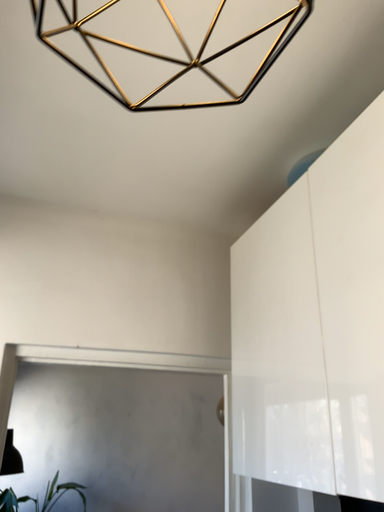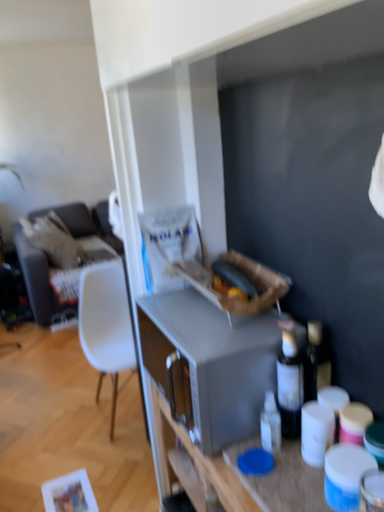
Question: How did the camera likely rotate when shooting the video?

Choices:
 (A) rotated right
 (B) rotated left

Answer: (A)